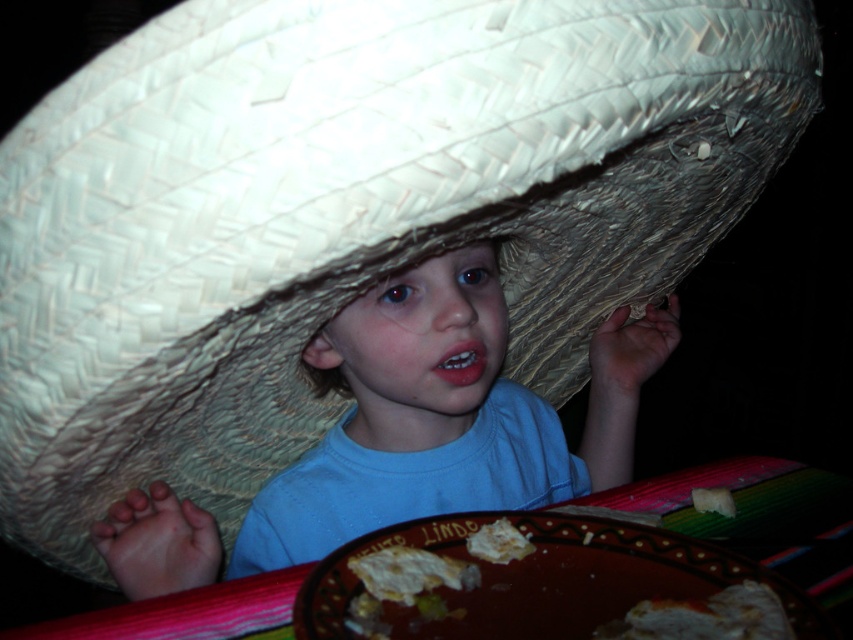
You are a photographer standing at a distance of 12 inches from the scene. You want to take a closeup shot of the brown ceramic platter at lower center. Is the platter within your reach for a closeup without moving your position?

The brown ceramic platter at lower center is 12.83 inches away from the viewer. Since you are standing at 12 inches, the platter is slightly further away, so you might need to move closer or adjust your lens to capture the closeup.

You are a food delivery robot that needs to place a new plate of food on the table. The yellowish crumbly bread at lower center is on the table. Where should you place the new plate to ensure it is at least 37 centimeters away from the bread?

Place the new plate at least 37 centimeters away from the yellowish crumbly bread at lower center. Since the minimum required distance is 37 cm and the current distance between them is 36.81 centimeters, you need to move the plate further away to meet the requirement.

You are a chef preparing a snack platter and need to choose between the yellowish crumbly bread at lower center and the white crumbly bread at lower center. Based on their sizes, which one would you select to ensure it can be easily broken into smaller pieces for serving?

The white crumbly bread at lower center is smaller in size compared to the yellowish crumbly bread at lower center, so it would be easier to break into smaller pieces for serving.